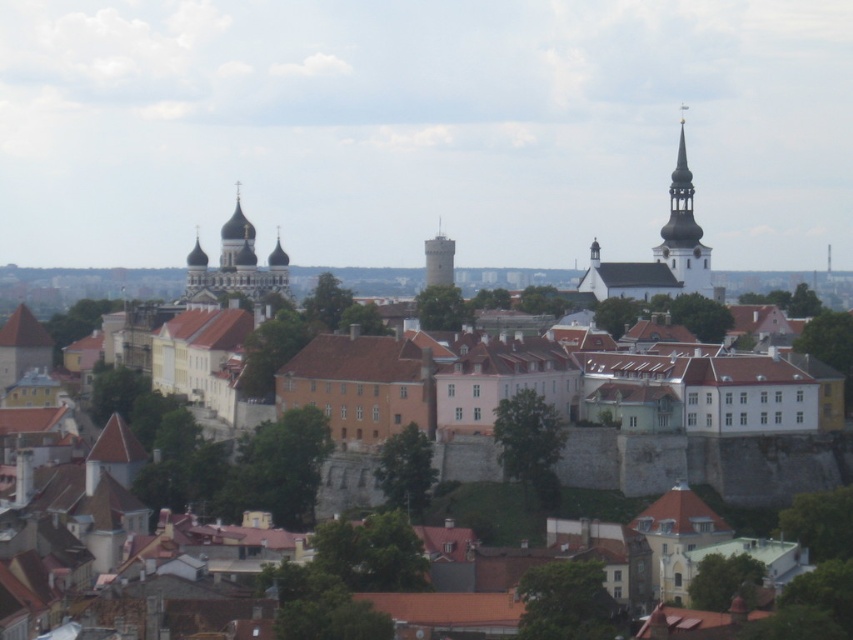
Which is above, dark gray stone tower at center-left or smooth white tower at center?

Positioned higher is smooth white tower at center.

You are a GUI agent. You are given a task and a screenshot of the screen. Output one action in this format:
    pyautogui.click(x=<x>, y=<y>)
    Task: Click on the dark gray stone tower at center-left
    This screenshot has width=853, height=640.
    Given the screenshot: What is the action you would take?
    pyautogui.click(x=235, y=264)

Measure the distance between dark gray stone tower at center-left and camera.

dark gray stone tower at center-left and camera are 754.89 feet apart.

Who is shorter, dark gray stone tower at center-left or white smooth steeple at upper right?

Standing shorter between the two is dark gray stone tower at center-left.

Describe the element at coordinates (235, 264) in the screenshot. I see `dark gray stone tower at center-left` at that location.

Locate an element on the screen. This screenshot has height=640, width=853. dark gray stone tower at center-left is located at coordinates (235, 264).

Can you confirm if white smooth steeple at upper right is smaller than smooth white tower at center?

Yes.

Where is `white smooth steeple at upper right`? white smooth steeple at upper right is located at coordinates (683, 232).